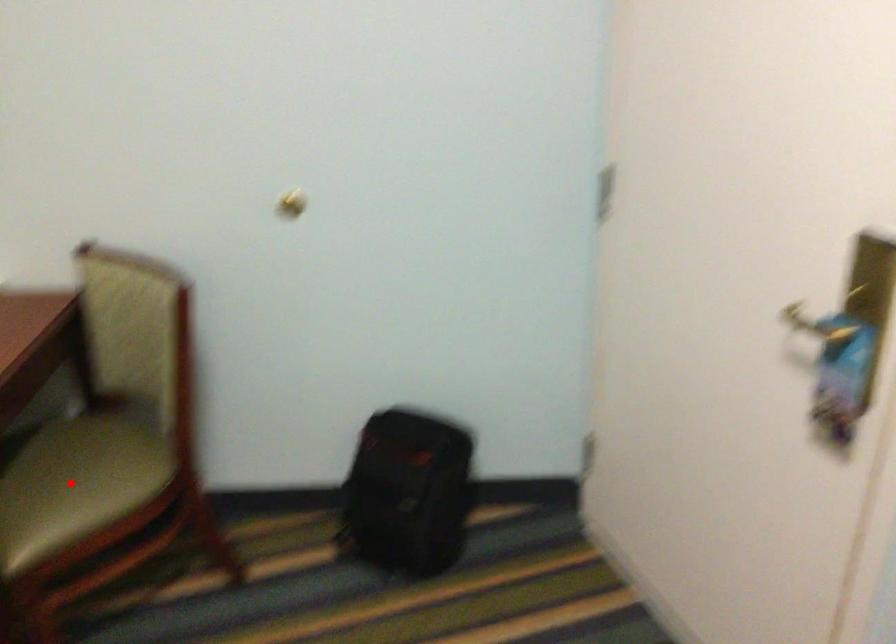
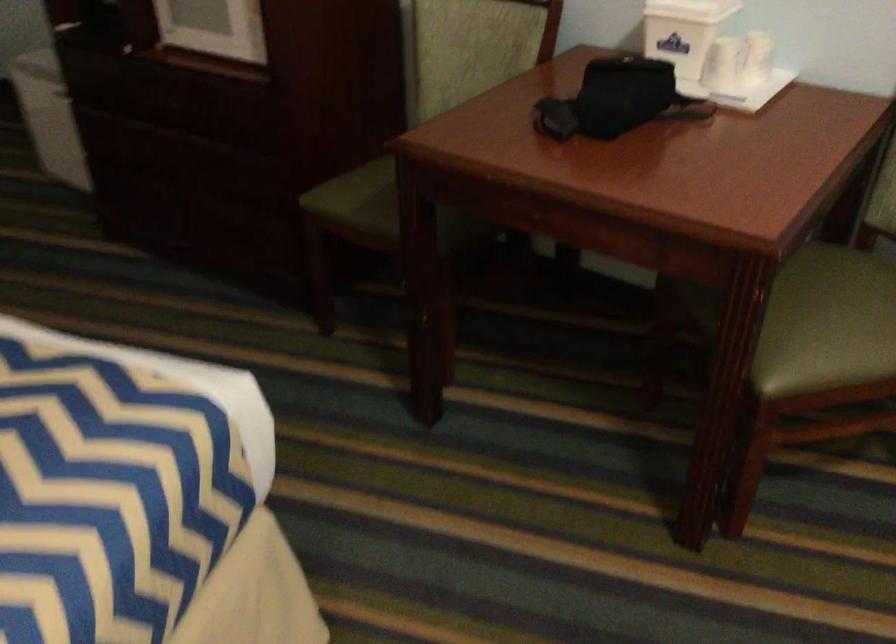
Find the pixel in the second image that matches the highlighted location in the first image.

(837, 316)